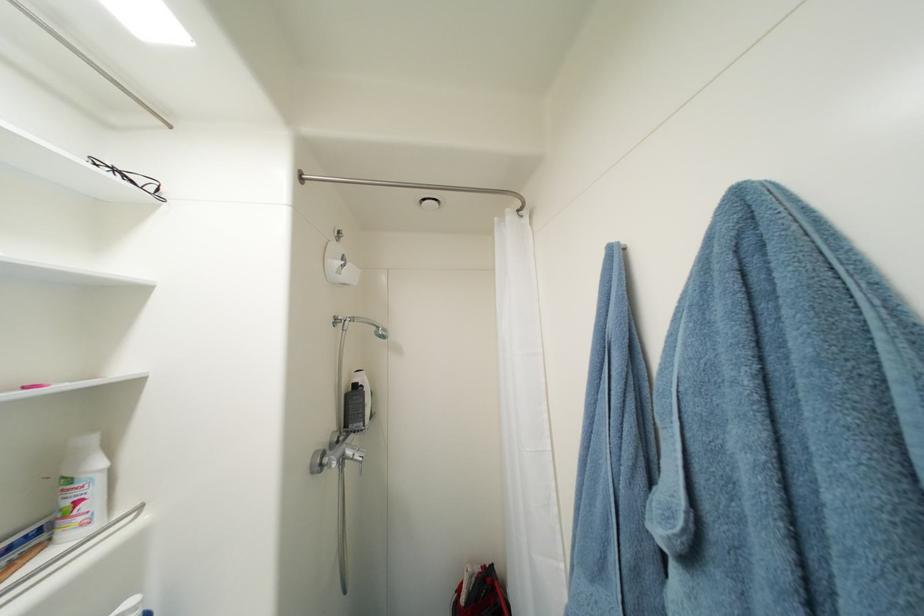
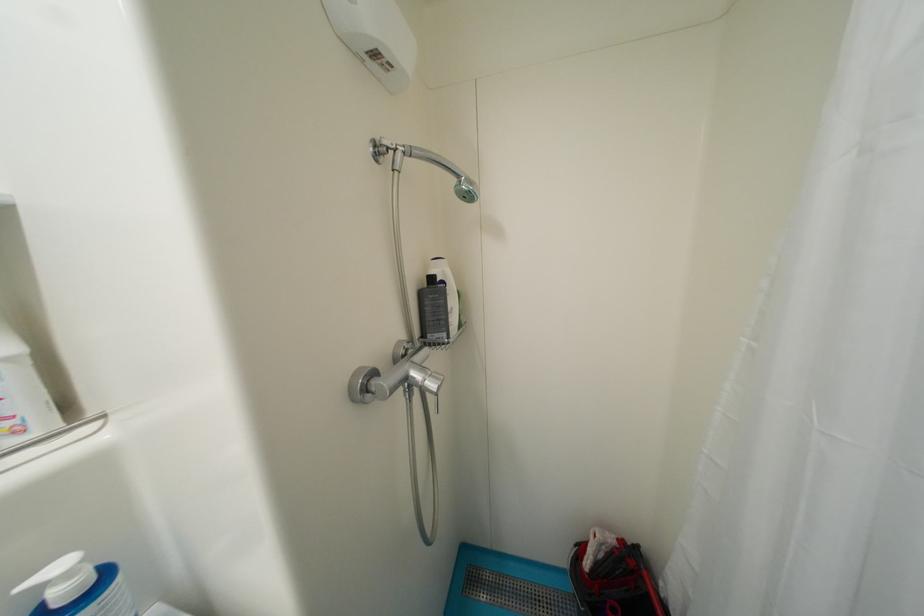
Question: The images are taken continuously from a first-person perspective. In which direction are you moving?

Choices:
 (A) Left
 (B) Right
 (C) Forward
 (D) Backward

Answer: (C)